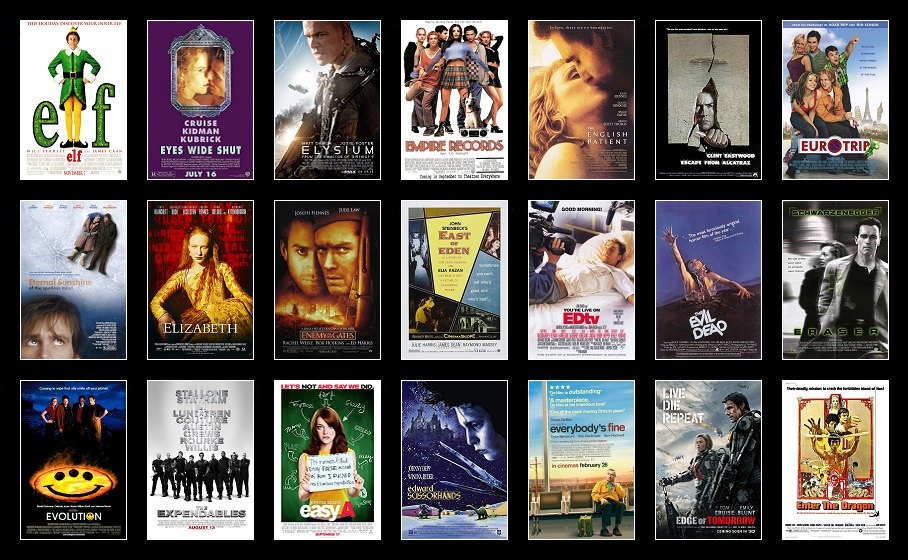
The width and height of the screenshot is (908, 560). Identify the location of posters in the center row. (65, 273), (198, 279), (316, 280), (445, 281), (576, 287), (689, 288), (807, 300).